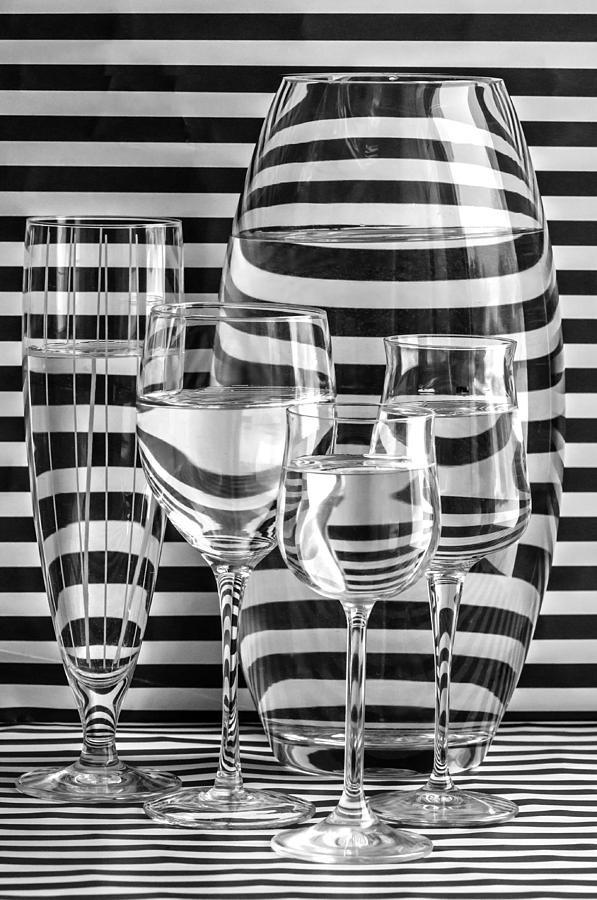
Locate an element on the screen. This screenshot has width=597, height=900. wine glasses is located at coordinates (110, 293), (247, 438), (374, 529), (483, 490), (432, 303).